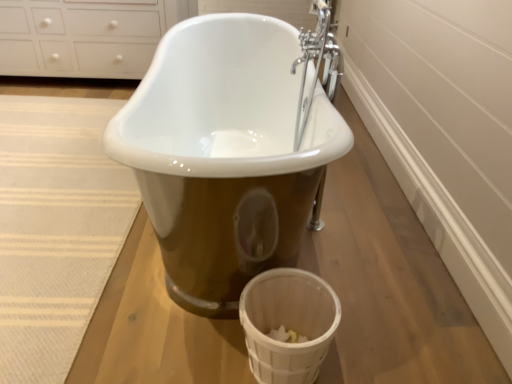
You are a GUI agent. You are given a task and a screenshot of the screen. Output one action in this format:
    pyautogui.click(x=<x>, y=<y>)
    Task: Click on the empty space that is to the right of white woven basket at lower right
    Image resolution: width=512 pixels, height=384 pixels.
    Given the screenshot: What is the action you would take?
    pyautogui.click(x=378, y=341)